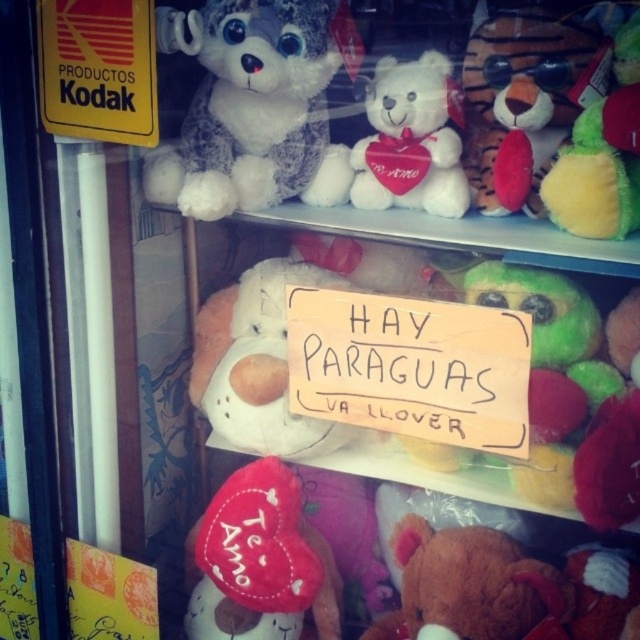
Does soft plush tiger at upper right appear over black kodak sign at upper left?

No.

Consider the image. Between soft plush tiger at upper right and black kodak sign at upper left, which one is positioned higher?

black kodak sign at upper left is higher up.

Identify the location of soft plush tiger at upper right. (518, 100).

Describe the element at coordinates (257, 364) in the screenshot. I see `white plush teddy bear at center` at that location.

Is point (304, 420) positioned after point (308, 572)?

Yes, point (304, 420) is farther from viewer.

Who is more forward, (266, 353) or (298, 534)?

Point (298, 534) is more forward.

Identify the location of white plush teddy bear at center. (257, 364).

Identify the location of white plush bear at center. (410, 140).

Is white plush bear at center wider than velvet plush toy at upper right?

Correct, the width of white plush bear at center exceeds that of velvet plush toy at upper right.

Is point (435, 148) closer to viewer compared to point (620, 60)?

No.

Image resolution: width=640 pixels, height=640 pixels. What are the coordinates of `white plush bear at center` in the screenshot? It's located at (410, 140).